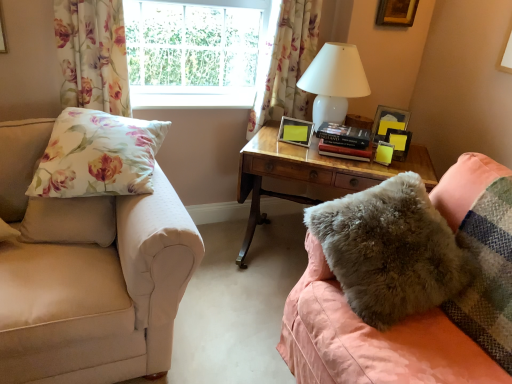
Question: Is floral fabric pillow at left, placed as the 2th pillow when sorted from right to left, completely or partially inside clear glass window at upper center?

Choices:
 (A) no
 (B) yes

Answer: (A)

Question: From the image's perspective, would you say clear glass window at upper center is shown under floral fabric pillow at left, the 1th pillow when ordered from left to right?

Choices:
 (A) yes
 (B) no

Answer: (B)

Question: Is clear glass window at upper center smaller than floral fabric pillow at left, placed as the 2th pillow when sorted from right to left?

Choices:
 (A) no
 (B) yes

Answer: (B)

Question: Is clear glass window at upper center thinner than floral fabric pillow at left, the 1th pillow when ordered from left to right?

Choices:
 (A) yes
 (B) no

Answer: (A)

Question: Is clear glass window at upper center aimed at floral fabric pillow at left, placed as the 2th pillow when sorted from right to left?

Choices:
 (A) yes
 (B) no

Answer: (A)

Question: Is clear glass window at upper center wider than floral fabric pillow at left, placed as the 2th pillow when sorted from right to left?

Choices:
 (A) yes
 (B) no

Answer: (B)

Question: Can you confirm if hardcover book at center is bigger than clear glass window at upper center?

Choices:
 (A) no
 (B) yes

Answer: (A)

Question: Is hardcover book at center to the right of clear glass window at upper center from the viewer's perspective?

Choices:
 (A) no
 (B) yes

Answer: (B)

Question: Would you say hardcover book at center is a long distance from clear glass window at upper center?

Choices:
 (A) no
 (B) yes

Answer: (A)

Question: Can you confirm if hardcover book at center is smaller than clear glass window at upper center?

Choices:
 (A) yes
 (B) no

Answer: (A)

Question: Is the surface of hardcover book at center in direct contact with clear glass window at upper center?

Choices:
 (A) no
 (B) yes

Answer: (A)

Question: Is clear glass window at upper center located within hardcover book at center?

Choices:
 (A) yes
 (B) no

Answer: (B)

Question: Is matte black picture frame at upper right, which is the 3th picture frame in bottom-to-top order, not close to floral fabric curtain at upper center, which is counted as the 1th curtain, starting from the right?

Choices:
 (A) no
 (B) yes

Answer: (A)